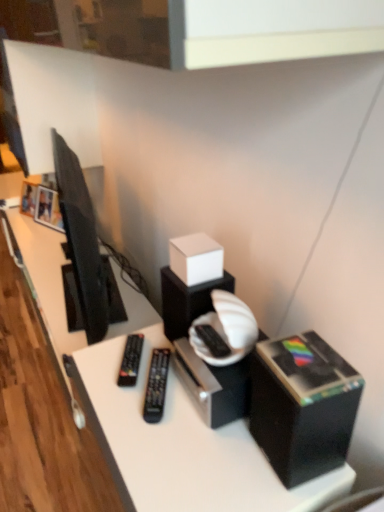
Question: Does black plastic box at lower right, the 2th box positioned from the back, appear on the right side of black plastic remote at center, acting as the 2th equipment starting from the left?

Choices:
 (A) no
 (B) yes

Answer: (B)

Question: Is black plastic box at lower right, which is counted as the 1th box, starting from the front, not close to black plastic remote at center, acting as the 2th equipment starting from the left?

Choices:
 (A) yes
 (B) no

Answer: (B)

Question: Is black plastic box at lower right, which is counted as the 1th box, starting from the front, bigger than black plastic remote at center, positioned as the first equipment in right-to-left order?

Choices:
 (A) yes
 (B) no

Answer: (A)

Question: Is black plastic box at lower right, the 2th box positioned from the back, closer to the viewer compared to black plastic remote at center, positioned as the first equipment in right-to-left order?

Choices:
 (A) no
 (B) yes

Answer: (B)

Question: Is black plastic box at lower right, the first box positioned from the right, not within black plastic remote at center, acting as the 2th equipment starting from the left?

Choices:
 (A) no
 (B) yes

Answer: (B)

Question: In the image, is matte black television at left on the left side or the right side of white matte cube at center, which is counted as the second box, starting from the right?

Choices:
 (A) right
 (B) left

Answer: (B)

Question: Considering the positions of matte black television at left and white matte cube at center, marked as the 2th box in a bottom-to-top arrangement, in the image, is matte black television at left taller or shorter than white matte cube at center, marked as the 2th box in a bottom-to-top arrangement,?

Choices:
 (A) short
 (B) tall

Answer: (B)

Question: Is point (102, 336) positioned closer to the camera than point (182, 268)?

Choices:
 (A) farther
 (B) closer

Answer: (A)

Question: From the image's perspective, is matte black television at left located above or below white matte cube at center, positioned as the 1th box in top-to-bottom order?

Choices:
 (A) below
 (B) above

Answer: (B)

Question: Based on their positions, is black plastic remote at center, which is counted as the first equipment, starting from the left, located to the left or right of matte black television at left?

Choices:
 (A) right
 (B) left

Answer: (A)

Question: Is black plastic remote at center, arranged as the 2th equipment when viewed from the right, inside or outside of matte black television at left?

Choices:
 (A) outside
 (B) inside

Answer: (A)

Question: Based on their sizes in the image, would you say black plastic remote at center, arranged as the 2th equipment when viewed from the right, is bigger or smaller than matte black television at left?

Choices:
 (A) big
 (B) small

Answer: (B)

Question: Considering the positions of point 125,368 and point 54,160, is point 125,368 closer or farther from the camera than point 54,160?

Choices:
 (A) closer
 (B) farther

Answer: (A)

Question: Looking at the image, does black plastic remote at center, arranged as the 2th equipment when viewed from the right, seem bigger or smaller compared to black plastic remote at center, acting as the 2th equipment starting from the left?

Choices:
 (A) small
 (B) big

Answer: (A)

Question: From a real-world perspective, is black plastic remote at center, which is counted as the first equipment, starting from the left, positioned above or below black plastic remote at center, acting as the 2th equipment starting from the left?

Choices:
 (A) below
 (B) above

Answer: (A)